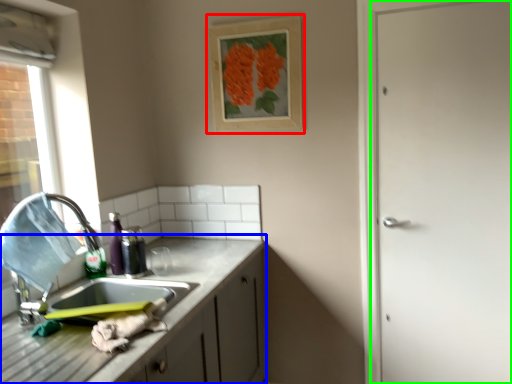
Question: Which object is the closest to the picture frame (highlighted by a red box)? Choose among these: cabinetry (highlighted by a blue box) or door (highlighted by a green box).

Choices:
 (A) cabinetry
 (B) door

Answer: (B)